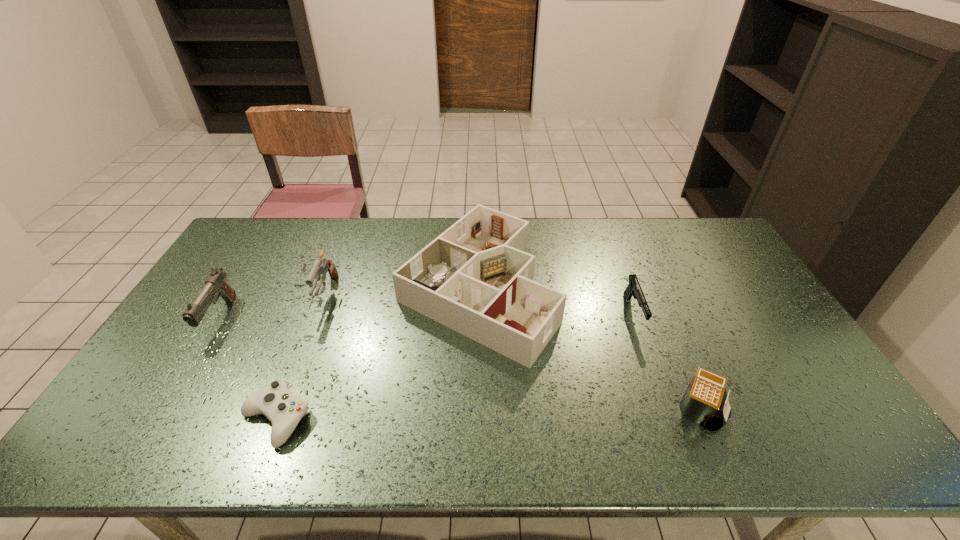
Identify which gun is the second nearest to the second gun from left to right. Please provide its 2D coordinates. Your answer should be formatted as a tuple, i.e. [(x, y)], where the tuple contains the x and y coordinates of a point satisfying the conditions above.

[(634, 289)]

Select which gun is the closest to the calculator. Please provide its 2D coordinates. Your answer should be formatted as a tuple, i.e. [(x, y)], where the tuple contains the x and y coordinates of a point satisfying the conditions above.

[(634, 289)]

In order to click on blank area in the image that satisfies the following two spatial constraints: 1. at the aiming end of the second object from right to left; 2. on the right side of the rightmost object in this screenshot , I will do `click(668, 409)`.

You are a GUI agent. You are given a task and a screenshot of the screen. Output one action in this format:
    pyautogui.click(x=<x>, y=<y>)
    Task: Click on the vacant region that satisfies the following two spatial constraints: 1. at the barrel end of the shortest object; 2. on the right side of the second gun from left to right
    The width and height of the screenshot is (960, 540).
    Given the screenshot: What is the action you would take?
    pyautogui.click(x=274, y=419)

The width and height of the screenshot is (960, 540). Identify the location of free space that satisfies the following two spatial constraints: 1. in the direction the control is aimed; 2. on the right side of the leftmost gun. (158, 419).

The width and height of the screenshot is (960, 540). I want to click on free space that satisfies the following two spatial constraints: 1. at the aiming end of the calculator; 2. on the right side of the fifth object from left to right, so click(668, 409).

Locate an element on the screen. The image size is (960, 540). vacant position in the image that satisfies the following two spatial constraints: 1. in the direction the calculator is aimed; 2. on the right side of the leftmost gun is located at coordinates (164, 409).